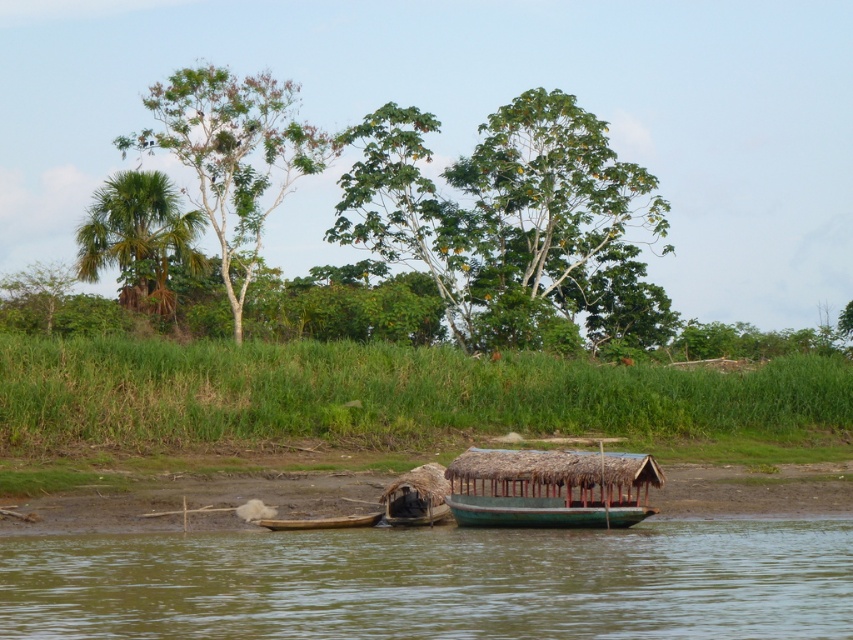
Does point (584, 593) come farther from viewer compared to point (392, 488)?

No, (584, 593) is closer to viewer.

Between point (314, 586) and point (422, 477), which one is positioned in front?

Point (314, 586) is in front.

Who is more forward, (x=257, y=588) or (x=410, y=481)?

Positioned in front is point (x=257, y=588).

Locate an element on the screen. The width and height of the screenshot is (853, 640). green matte boat at lower center is located at coordinates (437, 582).

Does green wooden boat at center have a larger size compared to wooden canoe at lower left?

Yes.

This screenshot has height=640, width=853. I want to click on green wooden boat at center, so click(x=550, y=486).

Can you confirm if green leafy tree at upper center is positioned to the right of green leafy palm tree at upper left?

Correct, you'll find green leafy tree at upper center to the right of green leafy palm tree at upper left.

Who is more forward, (x=531, y=140) or (x=160, y=180)?

Point (x=160, y=180) is in front.

Where is `green leafy tree at upper center`? The width and height of the screenshot is (853, 640). green leafy tree at upper center is located at coordinates (552, 188).